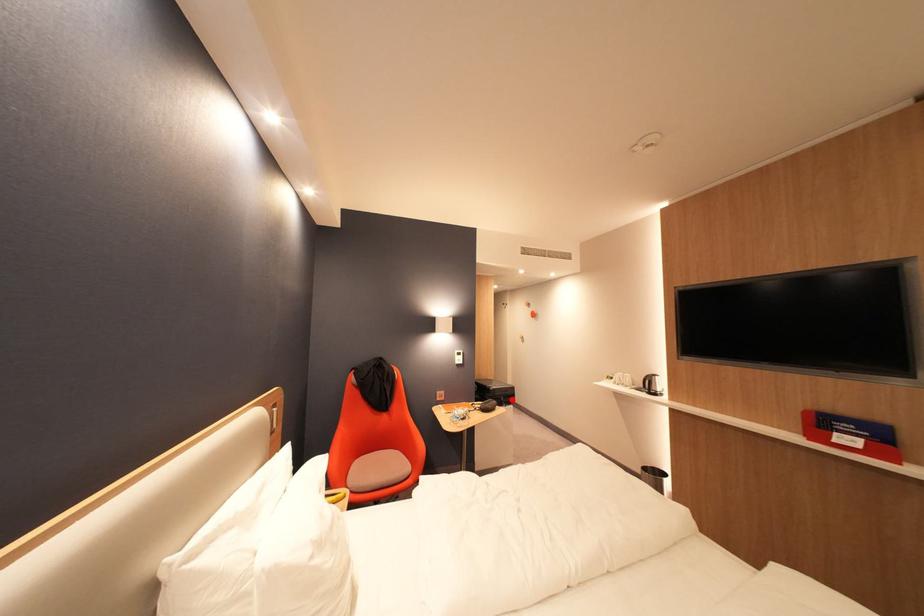
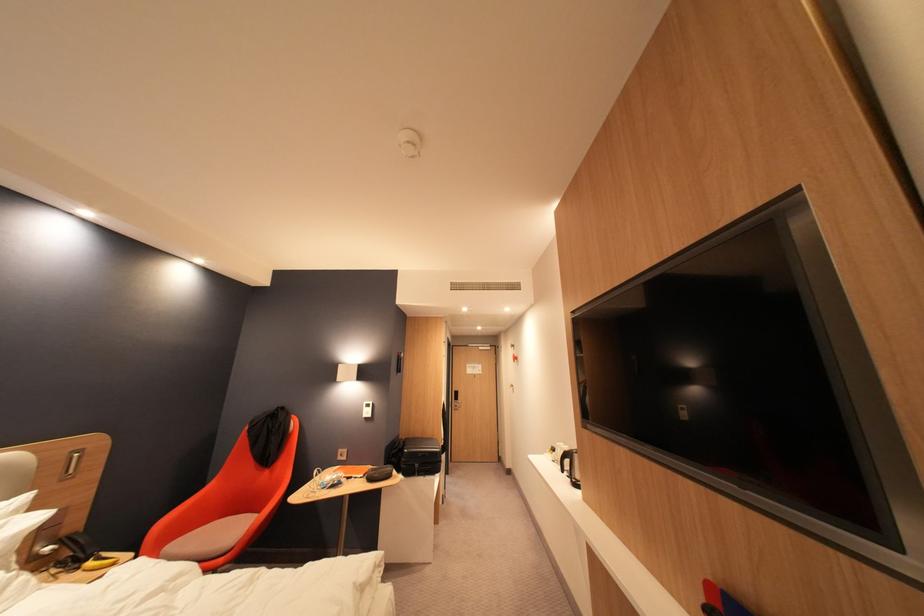
Locate, in the second image, the point that corresponds to the highlighted location in the first image.

(427, 467)